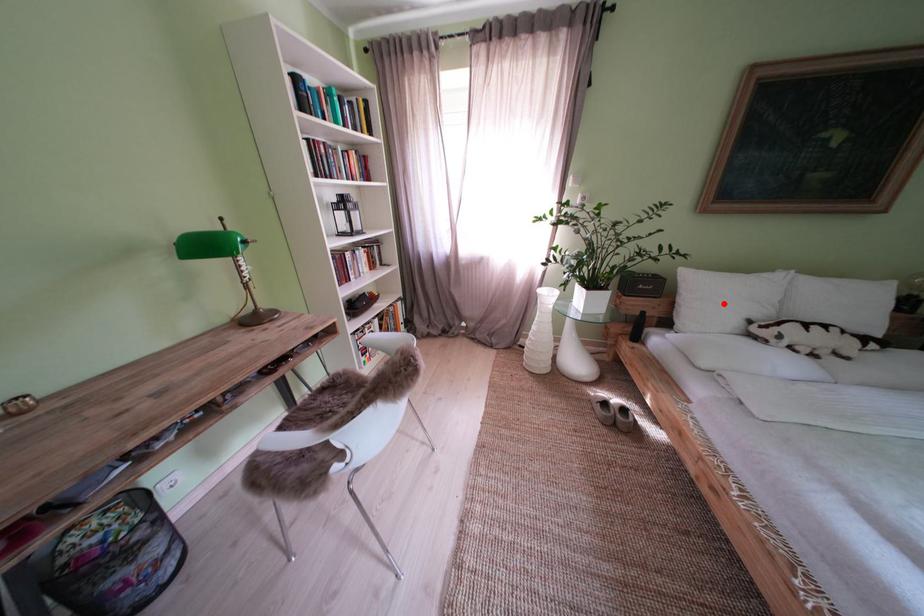
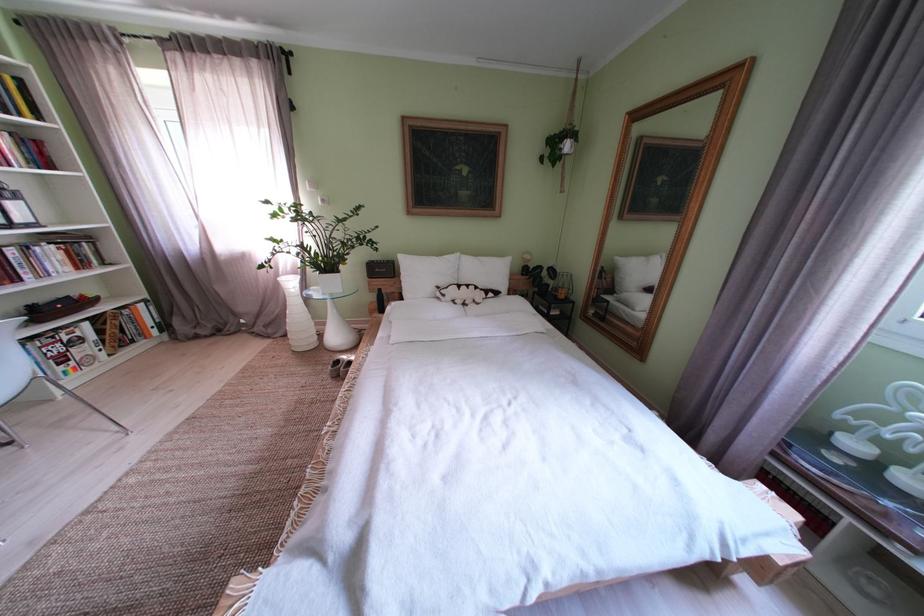
Question: I am providing you with two images of the same scene from different viewpoints. Given a red point in image1, look at the same physical point in image2. Is it:

Choices:
 (A) Closer to the viewpoint
 (B) Farther from the viewpoint

Answer: (A)